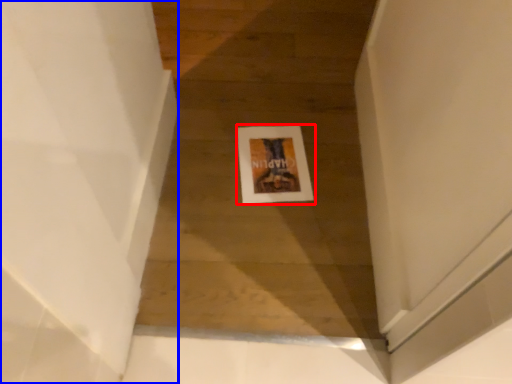
Question: Which point is closer to the camera, picture frame (highlighted by a red box) or stairwell (highlighted by a blue box)?

Choices:
 (A) picture frame
 (B) stairwell

Answer: (B)